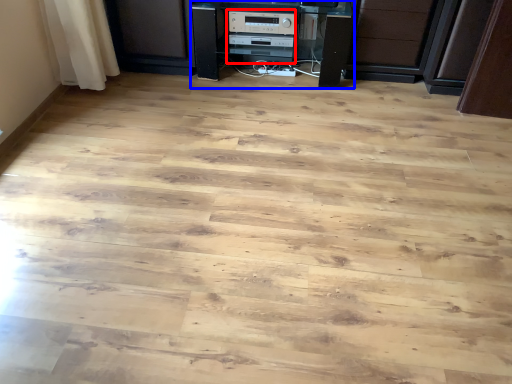
Question: Which object appears farthest to the camera in this image, appliance (highlighted by a red box) or furniture (highlighted by a blue box)?

Choices:
 (A) appliance
 (B) furniture

Answer: (A)